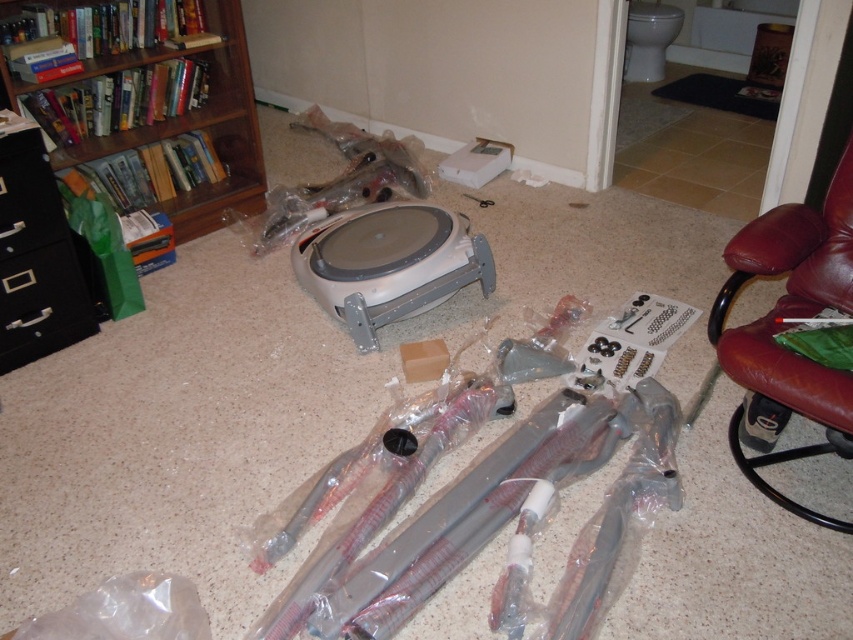
You are trying to decide where to place the brown leather armchair at right and the white plastic robotic vacuum cleaner at center in the room. Which object has a smaller width?

The brown leather armchair at right is thinner than the white plastic robotic vacuum cleaner at center, so the brown leather armchair at right has a smaller width.

You are trying to assemble the robotic vacuum cleaner in the center. You need to move the wooden bookshelf at left and the black plastic drawer at left to make space. Which object should you move first to create more space?

The wooden bookshelf at left is positioned over the black plastic drawer at left, so you should move the wooden bookshelf at left first to access and move the black plastic drawer at left, thereby creating more space.